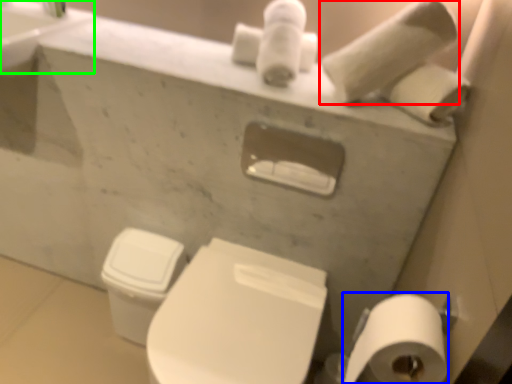
Question: Considering the real-world distances, which object is closest to toilet paper (highlighted by a red box)? toilet paper (highlighted by a blue box) or sink (highlighted by a green box).

Choices:
 (A) toilet paper
 (B) sink

Answer: (A)